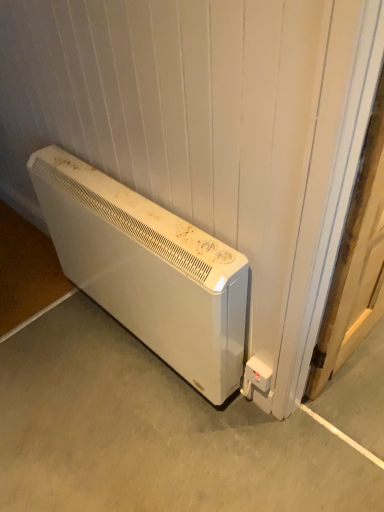
The height and width of the screenshot is (512, 384). In order to click on free spot in front of white plastic electric outlet at lower right in this screenshot , I will do `click(257, 445)`.